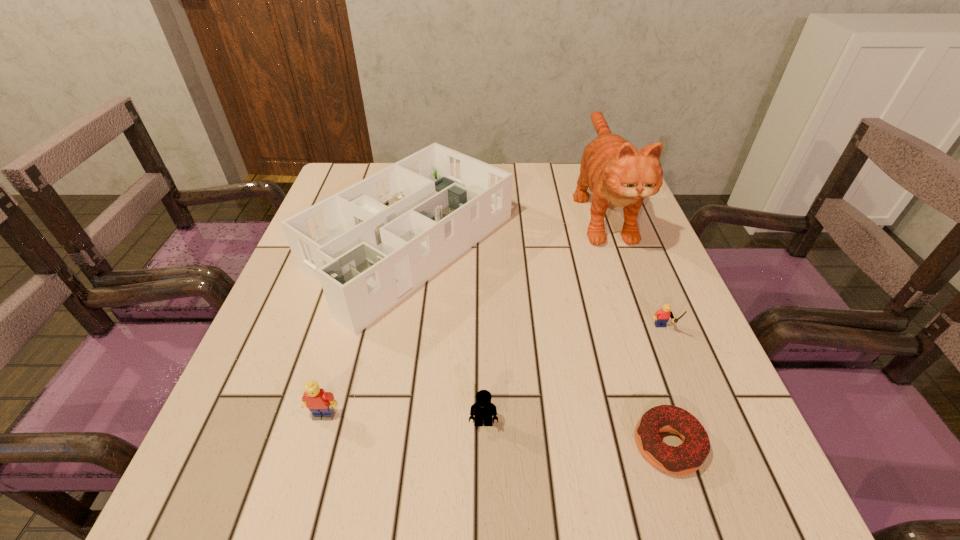
Locate an element on the screen. The image size is (960, 540). object that is at the far left corner is located at coordinates (372, 244).

Locate an element on the screen. This screenshot has width=960, height=540. object that is at the far right corner is located at coordinates (617, 174).

What are the coordinates of `object positioned at the near right corner` in the screenshot? It's located at (688, 457).

At what (x,y) coordinates should I click in order to perform the action: click on vacant area at the far edge of the desktop. Please return your answer as a coordinate pair (x, y). The width and height of the screenshot is (960, 540). Looking at the image, I should click on (541, 172).

Where is `free space at the near edge of the desktop`? This screenshot has height=540, width=960. free space at the near edge of the desktop is located at coordinates (601, 474).

The width and height of the screenshot is (960, 540). In the image, there is a desktop. In order to click on free space at the left edge in this screenshot , I will do `click(305, 374)`.

Find the location of `vacant space at the right edge`. vacant space at the right edge is located at coordinates (638, 310).

Where is `vacant area that lies between the second Lego from right to left and the dollhouse`? The height and width of the screenshot is (540, 960). vacant area that lies between the second Lego from right to left and the dollhouse is located at coordinates (446, 334).

Identify the location of free space between the second Lego from left to right and the shortest object. Image resolution: width=960 pixels, height=540 pixels. (576, 434).

Where is `blank region between the doughnut and the leftmost Lego`? The width and height of the screenshot is (960, 540). blank region between the doughnut and the leftmost Lego is located at coordinates (496, 430).